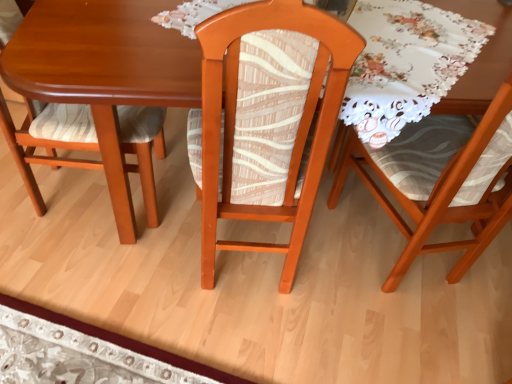
Question: In terms of width, does wooden table at center look wider or thinner when compared to matte wood chair at left, the 1th chair in the left-to-right sequence?

Choices:
 (A) thin
 (B) wide

Answer: (B)

Question: Is wooden table at center to the left or to the right of matte wood chair at left, positioned as the 3th chair in right-to-left order, in the image?

Choices:
 (A) left
 (B) right

Answer: (B)

Question: Which object is positioned farthest from the wooden chair at center, marked as the second chair in a left-to-right arrangement?

Choices:
 (A) wooden chair at right, positioned as the 1th chair in right-to-left order
 (B) wooden table at center
 (C) matte wood chair at left, positioned as the 3th chair in right-to-left order

Answer: (A)

Question: Estimate the real-world distances between objects in this image. Which object is farther from the matte wood chair at left, the 1th chair in the left-to-right sequence?

Choices:
 (A) wooden chair at center, marked as the second chair in a left-to-right arrangement
 (B) wooden chair at right, which ranks as the 3th chair in left-to-right order
 (C) wooden table at center

Answer: (B)